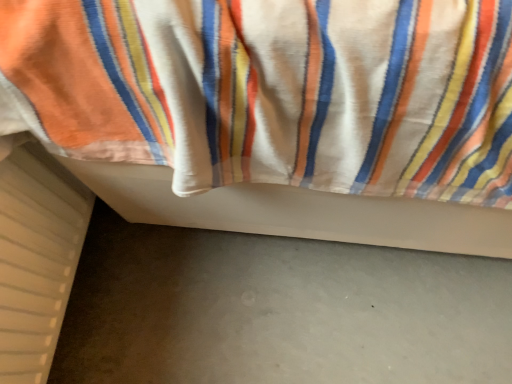
The height and width of the screenshot is (384, 512). Describe the element at coordinates (36, 257) in the screenshot. I see `white plastic radiator at lower left` at that location.

Identify the location of white plastic radiator at lower left. This screenshot has height=384, width=512. (36, 257).

At what (x,y) coordinates should I click in order to perform the action: click on white plastic radiator at lower left. Please return your answer as a coordinate pair (x, y). This screenshot has width=512, height=384. Looking at the image, I should click on (36, 257).